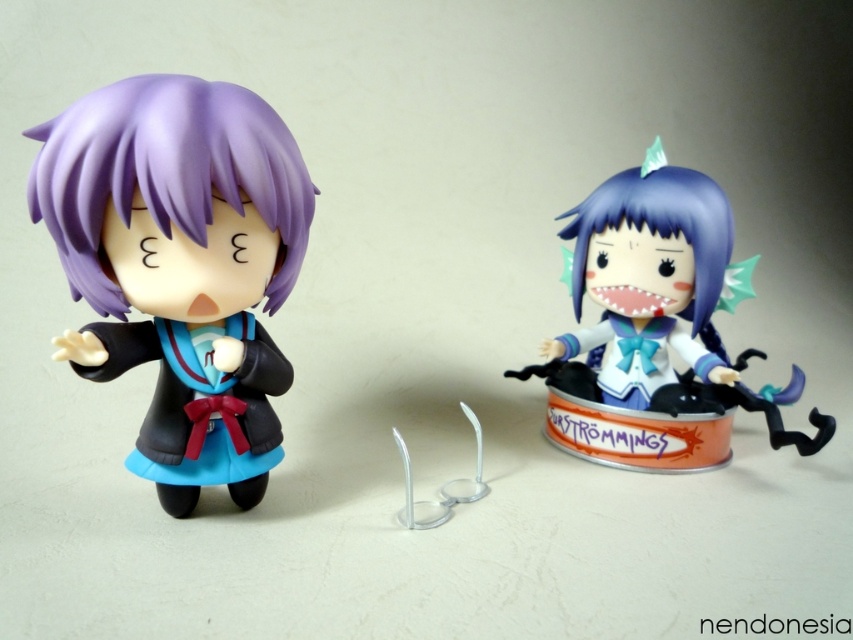
Question: Can you confirm if matte black doll at left is bigger than satin blue figurine at center?

Choices:
 (A) no
 (B) yes

Answer: (A)

Question: Among these points, which one is nearest to the camera?

Choices:
 (A) (102, 196)
 (B) (717, 371)

Answer: (A)

Question: Does matte black doll at left appear on the right side of satin blue figurine at center?

Choices:
 (A) no
 (B) yes

Answer: (A)

Question: Does matte black doll at left appear under satin blue figurine at center?

Choices:
 (A) no
 (B) yes

Answer: (B)

Question: Which object appears farthest from the camera in this image?

Choices:
 (A) satin blue figurine at center
 (B) matte black doll at left

Answer: (A)